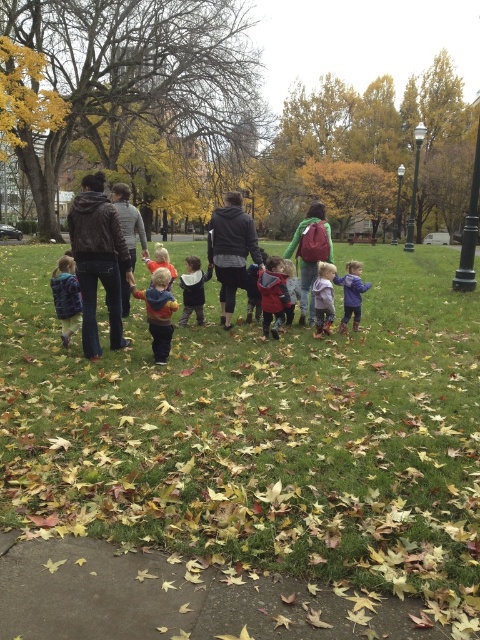
You are part of the group walking on the grassy area. You notice two people wearing jackets. One is wearing a matte black jacket at center and the other a matte blue hoodie at center. Which one is positioned more to the right?

The matte black jacket at center is positioned more to the right than the matte blue hoodie at center.

You are a photographer standing at the edge of the grassy area. You want to take a photo of the dark gray hoodie at center and the concrete pavement at lower left. Which object should you focus on first if you want to capture both in the same frame?

The concrete pavement at lower left is not as tall as the dark gray hoodie at center, so you should focus on the dark gray hoodie at center first to ensure both are in focus.

You are standing in the park and see two points marked on the ground. The first point is at coordinate point (165,557) and the second is at point (253,228). Which point is closer to you?

Point (165,557) is closer to the viewer than point (253,228).